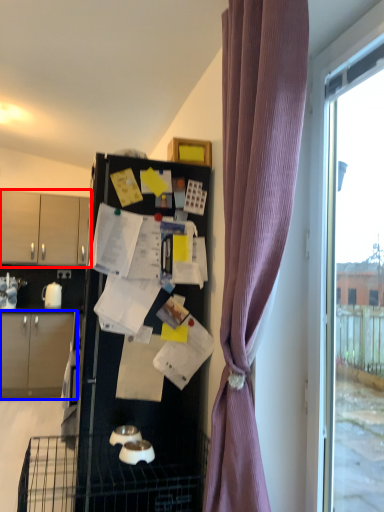
Question: Which object is further to the camera taking this photo, cabinetry (highlighted by a red box) or cabinetry (highlighted by a blue box)?

Choices:
 (A) cabinetry
 (B) cabinetry

Answer: (A)